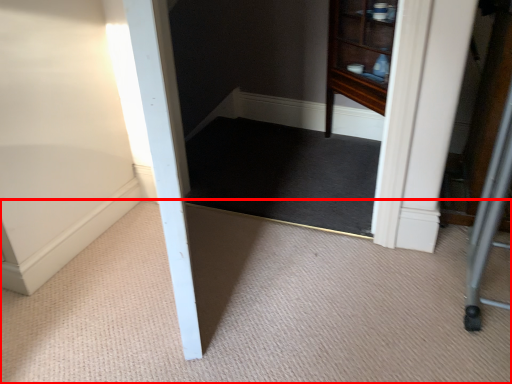
Question: From the image's perspective, where is plain (annotated by the red box) located relative to mat?

Choices:
 (A) below
 (B) above

Answer: (A)